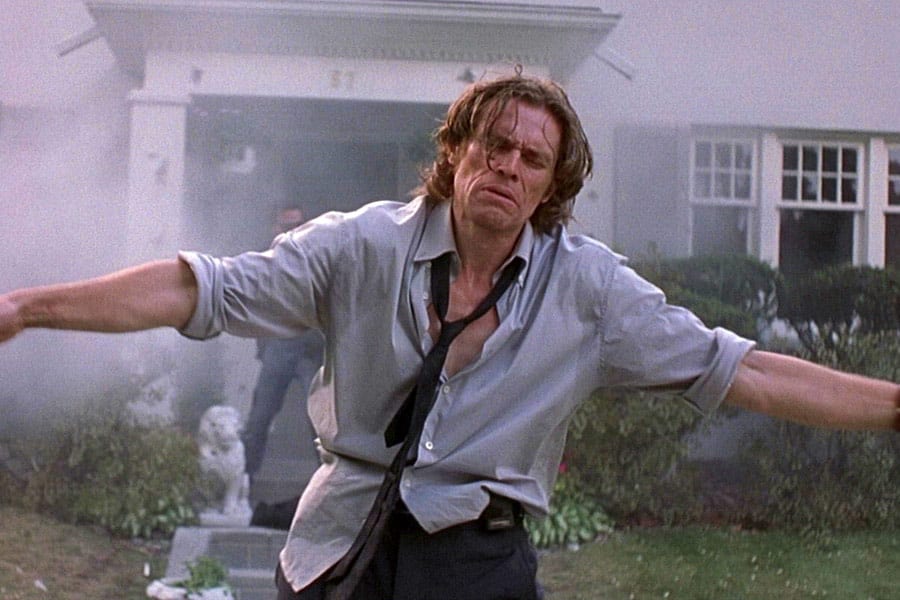
This screenshot has height=600, width=900. Find the location of `windows`. windows is located at coordinates (732, 198), (816, 204), (892, 204).